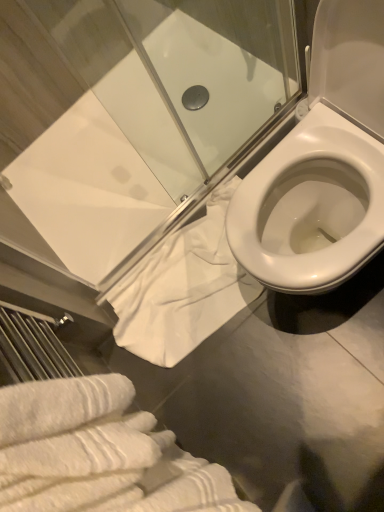
Question: Should I look upward or downward to see transparent glass shower door at upper center?

Choices:
 (A) up
 (B) down

Answer: (A)

Question: Can you confirm if white textured bath towel at lower left, which is counted as the second bath towel, starting from the back, is wider than white cotton towel at lower center, acting as the first bath towel starting from the back?

Choices:
 (A) no
 (B) yes

Answer: (A)

Question: Is white cotton towel at lower center, acting as the first bath towel starting from the back, at the back of white textured bath towel at lower left, which is counted as the second bath towel, starting from the back?

Choices:
 (A) yes
 (B) no

Answer: (B)

Question: From the image's perspective, is white textured bath towel at lower left, the first bath towel in the front-to-back sequence, over white cotton towel at lower center, acting as the first bath towel starting from the back?

Choices:
 (A) yes
 (B) no

Answer: (B)

Question: Does white textured bath towel at lower left, which is counted as the second bath towel, starting from the back, have a lesser width compared to white cotton towel at lower center, acting as the first bath towel starting from the back?

Choices:
 (A) yes
 (B) no

Answer: (A)

Question: From the image's perspective, is white textured bath towel at lower left, the first bath towel in the front-to-back sequence, located beneath white cotton towel at lower center, which is the 2th bath towel from front to back?

Choices:
 (A) yes
 (B) no

Answer: (A)

Question: Is white cotton towel at lower center, acting as the first bath towel starting from the back, inside white textured bath towel at lower left, which is counted as the second bath towel, starting from the back?

Choices:
 (A) no
 (B) yes

Answer: (A)

Question: Considering the relative sizes of transparent glass shower door at upper center and white cotton towel at lower center, which is the 2th bath towel from front to back, in the image provided, is transparent glass shower door at upper center taller than white cotton towel at lower center, which is the 2th bath towel from front to back,?

Choices:
 (A) yes
 (B) no

Answer: (A)

Question: From a real-world perspective, is transparent glass shower door at upper center located higher than white cotton towel at lower center, acting as the first bath towel starting from the back?

Choices:
 (A) no
 (B) yes

Answer: (B)

Question: From the image's perspective, would you say transparent glass shower door at upper center is shown under white cotton towel at lower center, which is the 2th bath towel from front to back?

Choices:
 (A) no
 (B) yes

Answer: (A)

Question: Does transparent glass shower door at upper center have a lesser width compared to white cotton towel at lower center, acting as the first bath towel starting from the back?

Choices:
 (A) no
 (B) yes

Answer: (B)

Question: Is transparent glass shower door at upper center closer to the viewer compared to white cotton towel at lower center, which is the 2th bath towel from front to back?

Choices:
 (A) yes
 (B) no

Answer: (A)

Question: Is transparent glass shower door at upper center positioned with its back to white cotton towel at lower center, acting as the first bath towel starting from the back?

Choices:
 (A) yes
 (B) no

Answer: (B)

Question: Is white cotton towel at lower center, which is the 2th bath towel from front to back, surrounding white textured bath towel at lower left, which is counted as the second bath towel, starting from the back?

Choices:
 (A) yes
 (B) no

Answer: (B)